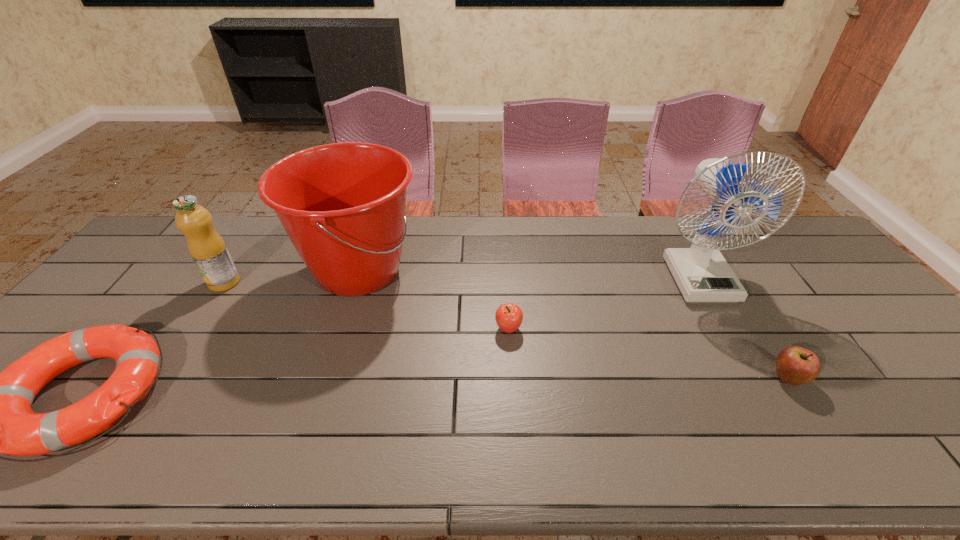
Identify the location of free space in the image that satisfies the following two spatial constraints: 1. on the front label of the third tallest object; 2. on the right side of the farther apple. This screenshot has height=540, width=960. (194, 329).